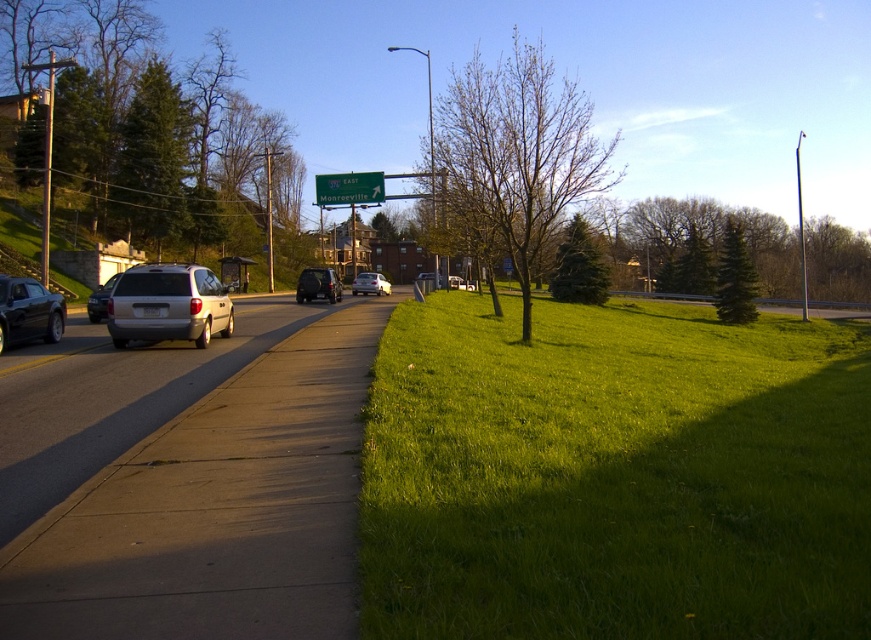
Between concrete sidewalk at center and silver metallic minivan at center-left, which one is positioned lower?

concrete sidewalk at center is lower down.

Who is more distant from viewer, (93, 536) or (198, 346)?

Positioned behind is point (198, 346).

Where is `concrete sidewalk at center`? concrete sidewalk at center is located at coordinates (215, 509).

Between green leafy tree at upper left and bare brown tree at center, which one appears on the right side from the viewer's perspective?

Positioned to the right is bare brown tree at center.

Does green leafy tree at upper left appear under bare brown tree at center?

Yes.

Which is in front, point (96, 176) or point (480, 182)?

Point (480, 182)

Identify the location of green leafy tree at upper left. This screenshot has width=871, height=640. (147, 116).

Can you confirm if green plastic sign at upper center is positioned above silver metallic van at center?

Correct, green plastic sign at upper center is located above silver metallic van at center.

Who is lower down, green plastic sign at upper center or silver metallic van at center?

silver metallic van at center is below.

Measure the distance between green plastic sign at upper center and camera.

green plastic sign at upper center is 44.62 meters away from camera.

Image resolution: width=871 pixels, height=640 pixels. Identify the location of green plastic sign at upper center. (349, 188).